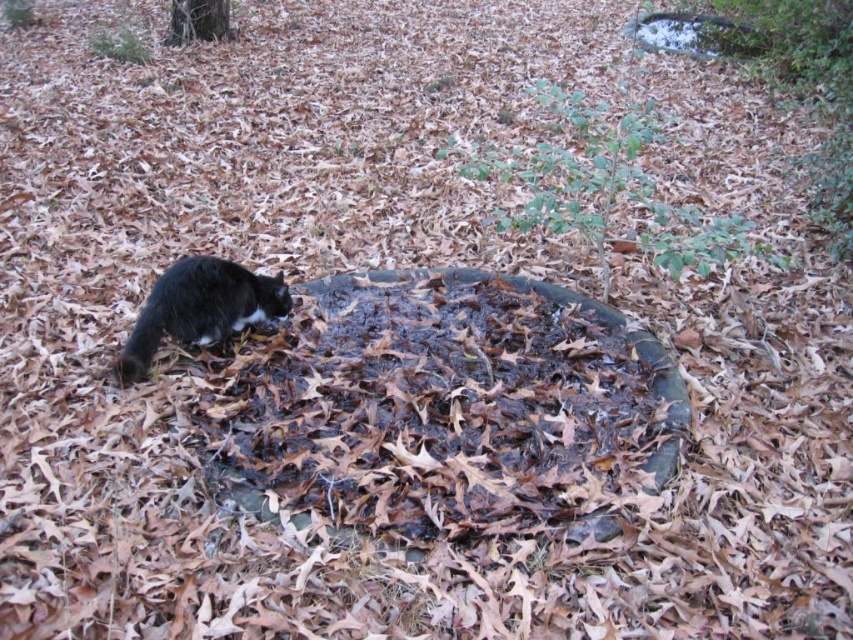
Question: Is black fur cat at lower left wider than smooth bark tree at upper left?

Choices:
 (A) yes
 (B) no

Answer: (A)

Question: Which of the following is the farthest from the observer?

Choices:
 (A) (126, 353)
 (B) (172, 26)

Answer: (B)

Question: Considering the relative positions of black fur cat at lower left and smooth bark tree at upper left in the image provided, where is black fur cat at lower left located with respect to smooth bark tree at upper left?

Choices:
 (A) above
 (B) below

Answer: (B)

Question: Which point is closer to the camera?

Choices:
 (A) black fur cat at lower left
 (B) smooth bark tree at upper left

Answer: (A)

Question: Is black fur cat at lower left below smooth bark tree at upper left?

Choices:
 (A) no
 (B) yes

Answer: (B)